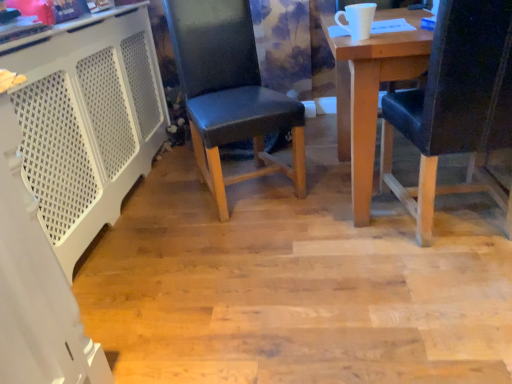
Identify the location of blank space to the left of black leather chair at center, placed as the 1th chair when sorted from left to right. The height and width of the screenshot is (384, 512). (168, 202).